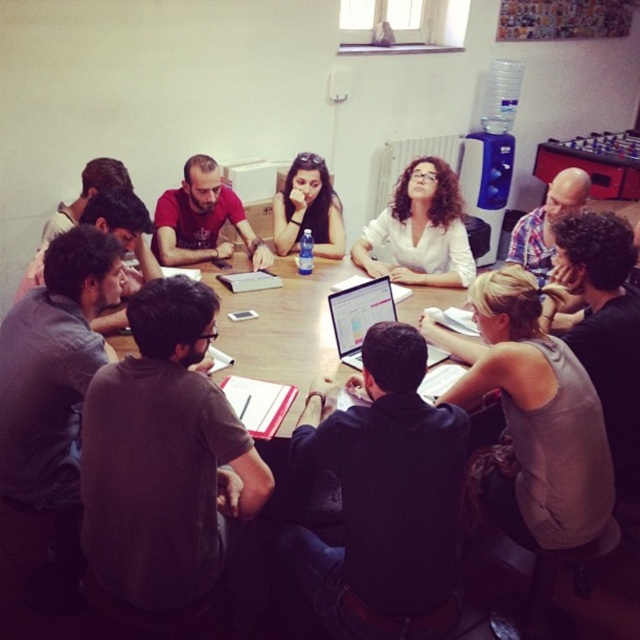
Looking at this image, you are standing in the meeting room and want to hand a document to the person wearing the gray sleeveless top at lower right. Where should you go to reach them?

The gray sleeveless top at lower right is located at point 0.642 on the x axis and 0.839 on the y axis, so you should go to the lower right area of the room to reach them.